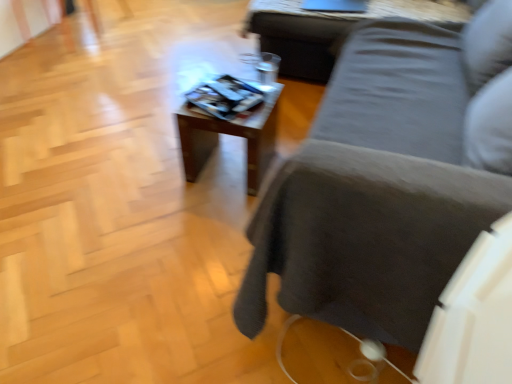
This screenshot has width=512, height=384. What are the coordinates of `free space above wooden table at center, arranged as the first table when viewed from the front (from a real-world perspective)` in the screenshot? It's located at (226, 101).